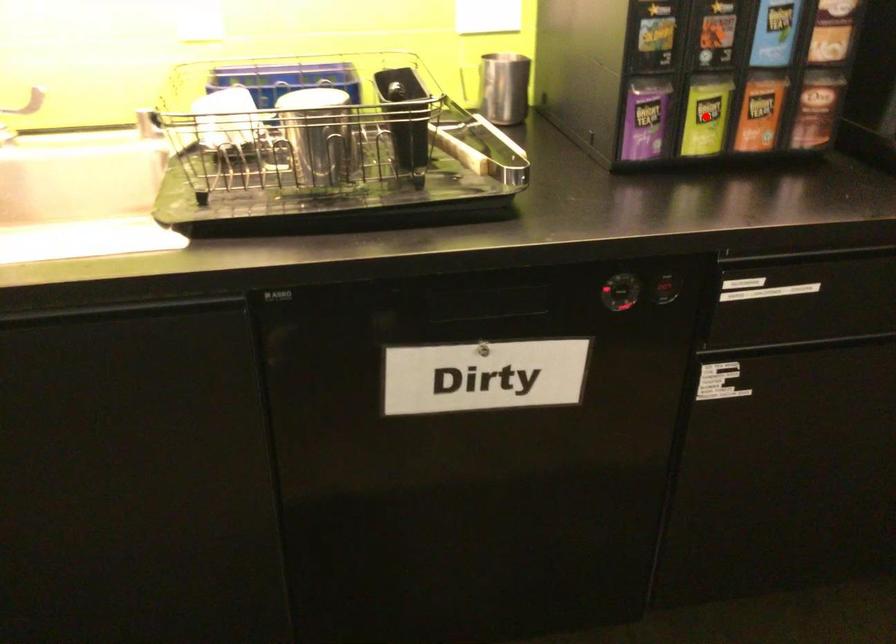
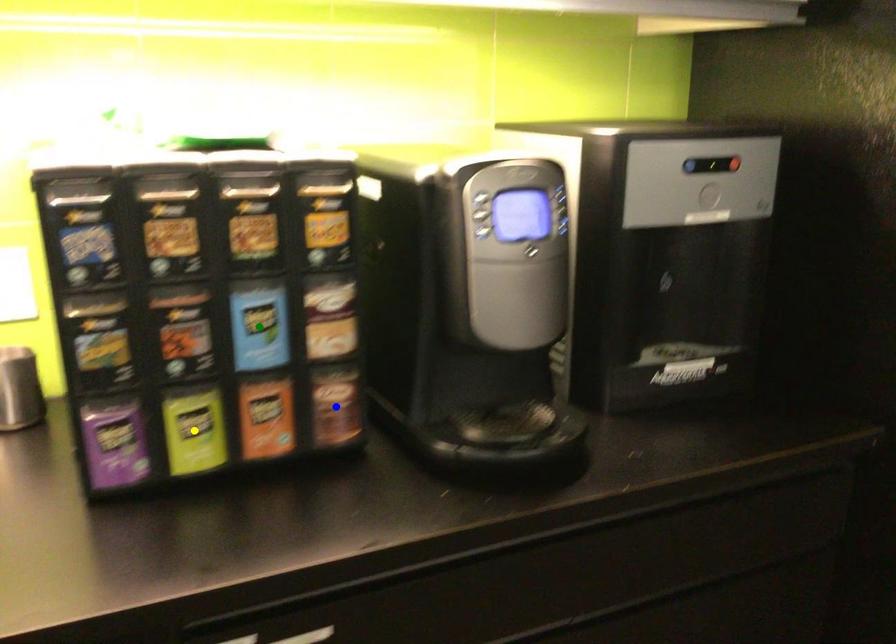
Question: I am providing you with two images of the same scene from different viewpoints. A red point is marked on the first image. You are given multiple points on the second image. Which point in image 2 represents the same 3d spot as the red point in image 1?

Choices:
 (A) green point
 (B) blue point
 (C) yellow point

Answer: (C)